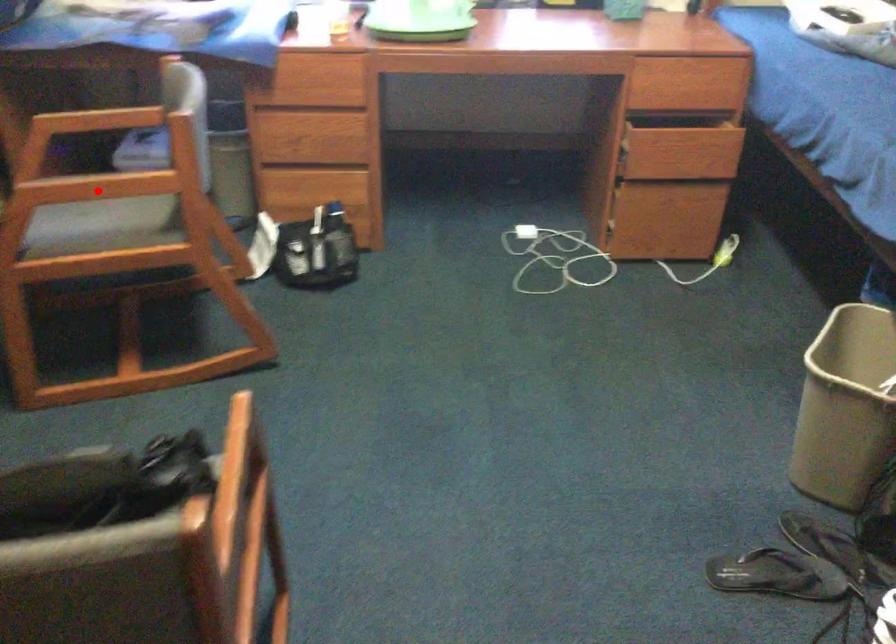
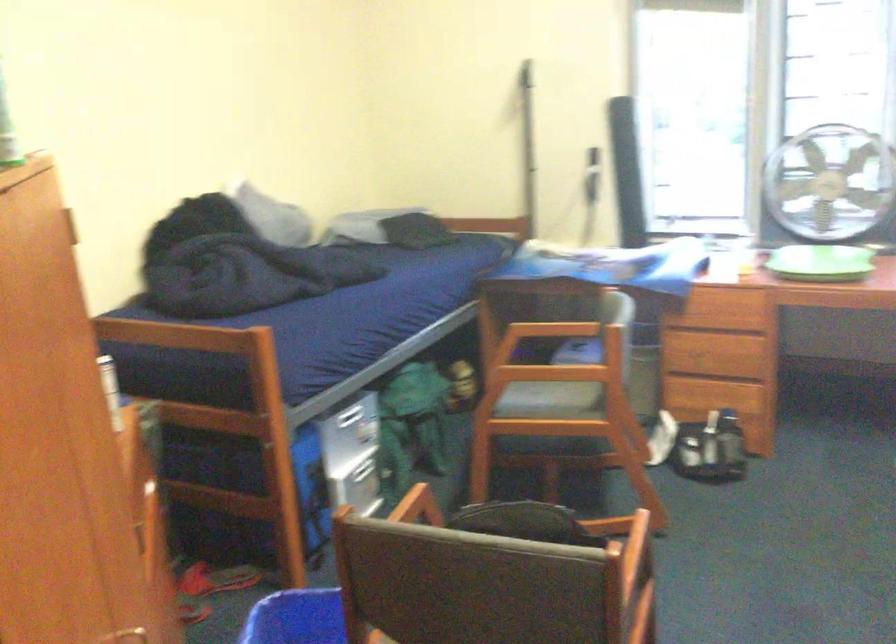
Question: I am providing you with two images of the same scene from different viewpoints. Given a red point in image1, look at the same physical point in image2. Is it:

Choices:
 (A) Closer to the viewpoint
 (B) Farther from the viewpoint

Answer: (B)